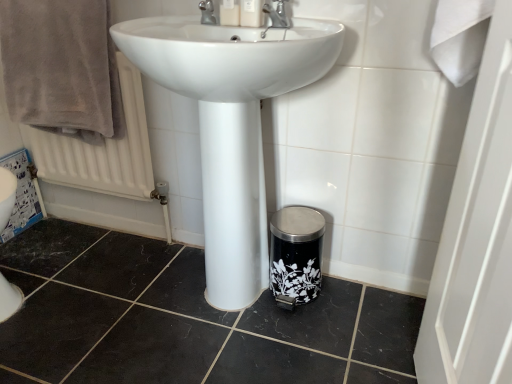
Question: Is white glossy sink at center further to camera compared to white textured radiator at upper left?

Choices:
 (A) yes
 (B) no

Answer: (B)

Question: Is white glossy sink at center to the right of white textured radiator at upper left from the viewer's perspective?

Choices:
 (A) yes
 (B) no

Answer: (A)

Question: From the image's perspective, is white glossy sink at center located above white textured radiator at upper left?

Choices:
 (A) yes
 (B) no

Answer: (B)

Question: From the image's perspective, does white glossy sink at center appear lower than white textured radiator at upper left?

Choices:
 (A) yes
 (B) no

Answer: (A)

Question: Is white glossy sink at center positioned with its back to white textured radiator at upper left?

Choices:
 (A) no
 (B) yes

Answer: (A)

Question: Considering the positions of point (x=245, y=23) and point (x=234, y=18), is point (x=245, y=23) closer or farther from the camera than point (x=234, y=18)?

Choices:
 (A) farther
 (B) closer

Answer: (B)

Question: Considering their positions, is white plastic soap dispenser at upper center, which ranks as the first toiletry in right-to-left order, located in front of or behind matte plastic soap dispenser at upper center, placed as the second toiletry when sorted from right to left?

Choices:
 (A) front
 (B) behind

Answer: (A)

Question: From a real-world perspective, relative to matte plastic soap dispenser at upper center, placed as the second toiletry when sorted from right to left, is white plastic soap dispenser at upper center, which is the second toiletry in left-to-right order, vertically above or below?

Choices:
 (A) below
 (B) above

Answer: (A)

Question: Is white plastic soap dispenser at upper center, which ranks as the first toiletry in right-to-left order, bigger or smaller than matte plastic soap dispenser at upper center, positioned as the first toiletry in left-to-right order?

Choices:
 (A) big
 (B) small

Answer: (A)

Question: In terms of width, does silver metallic tap at upper center, which ranks as the second tap in right-to-left order, look wider or thinner when compared to black marble tile at lower center?

Choices:
 (A) wide
 (B) thin

Answer: (B)

Question: Visually, is silver metallic tap at upper center, which ranks as the 1th tap in left-to-right order, positioned to the left or to the right of black marble tile at lower center?

Choices:
 (A) right
 (B) left

Answer: (A)

Question: Would you say silver metallic tap at upper center, which ranks as the second tap in right-to-left order, is inside or outside black marble tile at lower center?

Choices:
 (A) outside
 (B) inside

Answer: (A)

Question: From a real-world perspective, relative to black marble tile at lower center, is silver metallic tap at upper center, which ranks as the 1th tap in left-to-right order, vertically above or below?

Choices:
 (A) above
 (B) below

Answer: (A)

Question: Would you say matte plastic soap dispenser at upper center, positioned as the first toiletry in left-to-right order, is to the left or to the right of white glossy sink at center in the picture?

Choices:
 (A) right
 (B) left

Answer: (A)

Question: Relative to white glossy sink at center, is matte plastic soap dispenser at upper center, positioned as the first toiletry in left-to-right order, in front or behind?

Choices:
 (A) behind
 (B) front

Answer: (A)